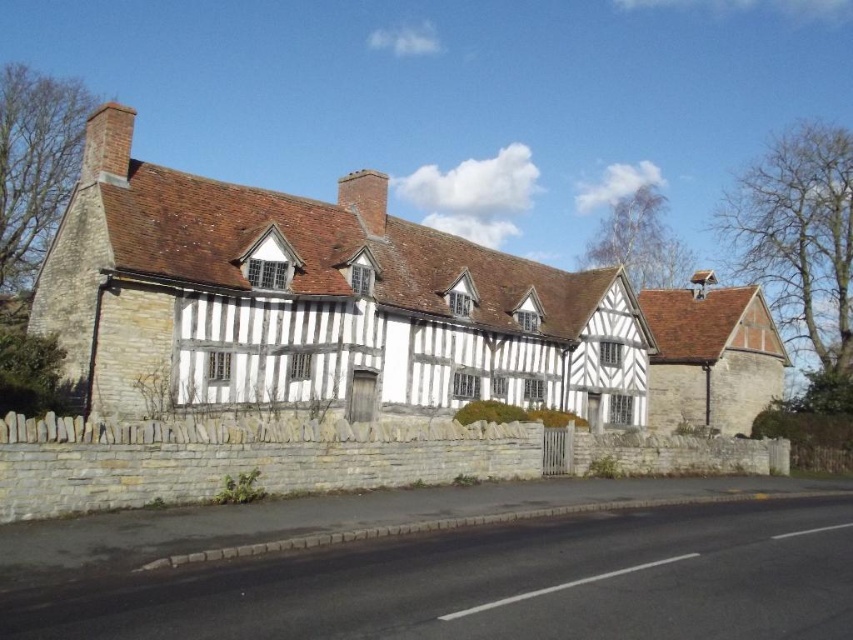
Question: Can you confirm if white timber-framed house at center is positioned to the left of brown shingles at upper right?

Choices:
 (A) yes
 (B) no

Answer: (A)

Question: Observing the image, what is the correct spatial positioning of white timber-framed house at center in reference to brown shingles at upper right?

Choices:
 (A) right
 (B) left

Answer: (B)

Question: Which point is farther to the camera?

Choices:
 (A) (705, 324)
 (B) (451, 368)

Answer: (A)

Question: Which point is closer to the camera?

Choices:
 (A) white timber-framed house at center
 (B) brown shingles at upper right

Answer: (A)

Question: Can you confirm if white timber-framed house at center is smaller than brown shingles at upper right?

Choices:
 (A) yes
 (B) no

Answer: (B)